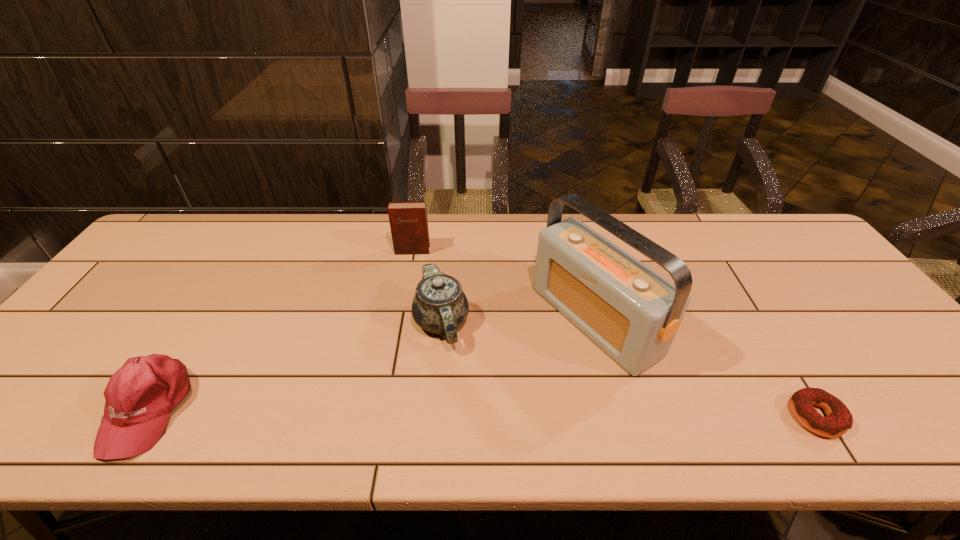
Locate an element on the screen. vacant space located on the front cover of the diary is located at coordinates pos(407,301).

This screenshot has height=540, width=960. Find the location of `vacant area located 0.300m on the front cover of the diary`. vacant area located 0.300m on the front cover of the diary is located at coordinates (403, 329).

Find the location of `vacant position located on the front-facing side of the tallest object`. vacant position located on the front-facing side of the tallest object is located at coordinates (529, 364).

Where is `vacant space located 0.230m on the front-facing side of the tallest object`? The image size is (960, 540). vacant space located 0.230m on the front-facing side of the tallest object is located at coordinates (473, 398).

Identify the location of vacant space located 0.210m on the front-facing side of the tallest object. (481, 394).

Image resolution: width=960 pixels, height=540 pixels. I want to click on vacant space situated from the spout of the third tallest object, so click(x=433, y=393).

The height and width of the screenshot is (540, 960). Find the location of `free location located 0.120m from the spout of the third tallest object`. free location located 0.120m from the spout of the third tallest object is located at coordinates (432, 401).

The image size is (960, 540). Find the location of `vacant space located from the spout of the third tallest object`. vacant space located from the spout of the third tallest object is located at coordinates (433, 393).

Locate an element on the screen. Image resolution: width=960 pixels, height=540 pixels. object that is at the far edge is located at coordinates (408, 221).

At what (x,y) coordinates should I click in order to perform the action: click on baseball cap present at the near edge. Please return your answer as a coordinate pair (x, y). This screenshot has width=960, height=540. Looking at the image, I should click on (140, 396).